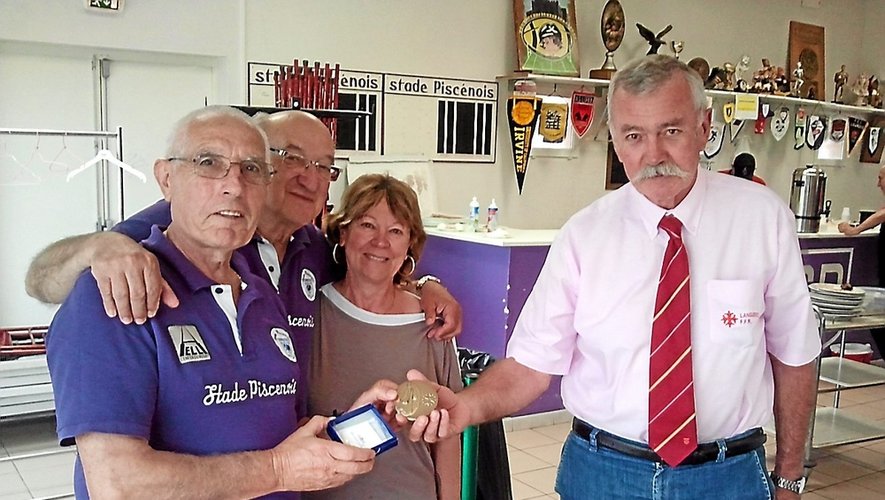
Identify the location of coffee maker. This screenshot has width=885, height=500. (810, 200).